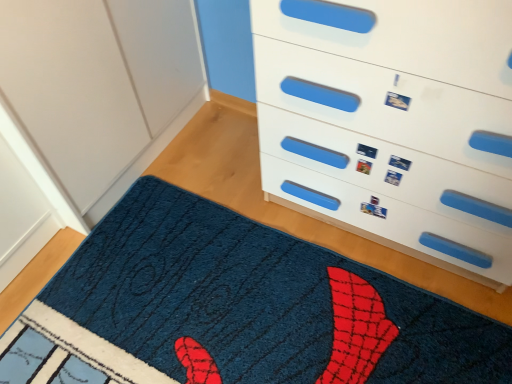
You are a GUI agent. You are given a task and a screenshot of the screen. Output one action in this format:
    pyautogui.click(x=<x>, y=<y>)
    Task: Click on the vacant region above blue shaggy mat at lower center (from a real-world perspective)
    Image resolution: width=512 pixels, height=384 pixels.
    Given the screenshot: What is the action you would take?
    pyautogui.click(x=234, y=311)